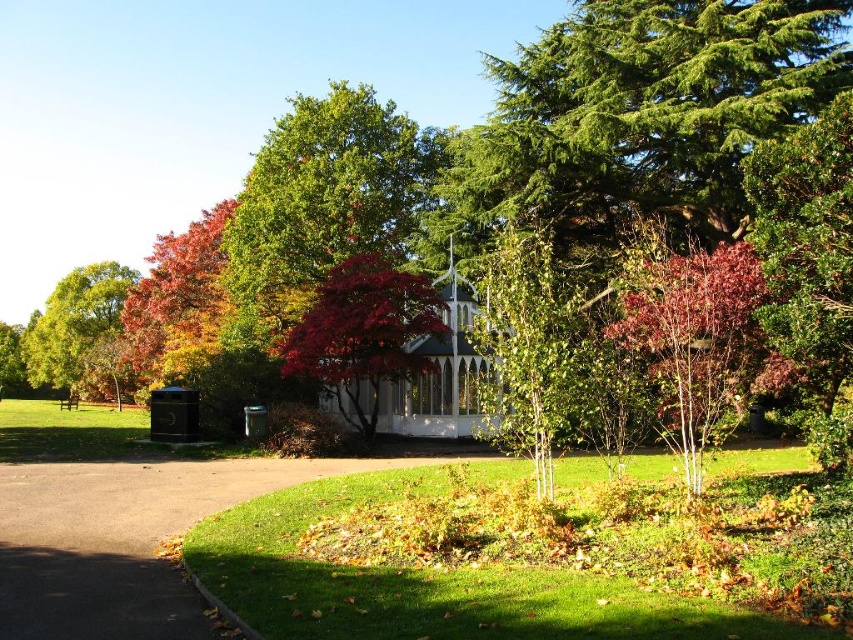
Does point (749, 177) lie in front of point (735, 337)?

Yes, point (749, 177) is in front of point (735, 337).

Can you confirm if green glossy bush at upper right is positioned to the left of purple-barked tree at center-right?

In fact, green glossy bush at upper right is to the right of purple-barked tree at center-right.

What do you see at coordinates (807, 250) in the screenshot? The width and height of the screenshot is (853, 640). I see `green glossy bush at upper right` at bounding box center [807, 250].

Where is `green glossy bush at upper right`? green glossy bush at upper right is located at coordinates (807, 250).

Is purple-barked tree at center-right to the right of white wood gazebo at center from the viewer's perspective?

Yes, purple-barked tree at center-right is to the right of white wood gazebo at center.

Who is positioned more to the left, purple-barked tree at center-right or white wood gazebo at center?

white wood gazebo at center

Measure the distance between purple-barked tree at center-right and camera.

27.70 feet

Image resolution: width=853 pixels, height=640 pixels. I want to click on purple-barked tree at center-right, so click(x=693, y=342).

What are the coordinates of `purple-barked tree at center-right` in the screenshot? It's located at (693, 342).

Does purple-barked tree at center-right have a larger size compared to green smooth tree at center?

Incorrect, purple-barked tree at center-right is not larger than green smooth tree at center.

Which is in front, point (660, 433) or point (517, 316)?

Point (517, 316) is more forward.

Where is `purple-barked tree at center-right`? The image size is (853, 640). purple-barked tree at center-right is located at coordinates (693, 342).